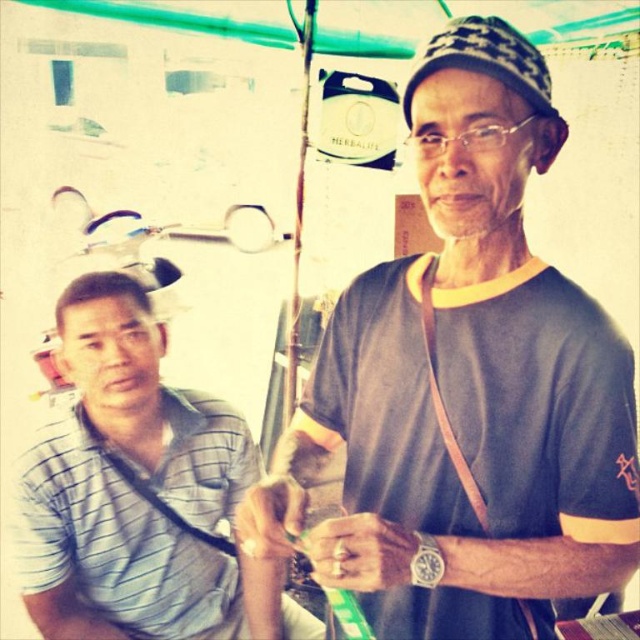
Question: Is dark gray/yellow t-shirt at upper right to the right of gray striped shirt at left from the viewer's perspective?

Choices:
 (A) yes
 (B) no

Answer: (A)

Question: Where is dark gray/yellow t-shirt at upper right located in relation to gray striped shirt at left in the image?

Choices:
 (A) left
 (B) right

Answer: (B)

Question: Where is dark gray/yellow t-shirt at upper right located in relation to gray striped shirt at left in the image?

Choices:
 (A) above
 (B) below

Answer: (A)

Question: Which point is closer to the camera?

Choices:
 (A) (150, 474)
 (B) (474, 266)

Answer: (B)

Question: Which of the following is the farthest from the observer?

Choices:
 (A) (476, 563)
 (B) (218, 554)

Answer: (B)